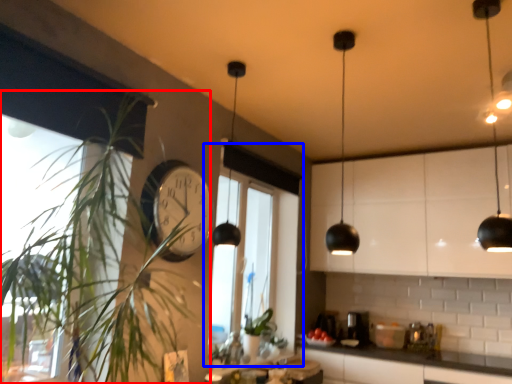
Question: Which object appears farthest to the camera in this image, houseplant (highlighted by a red box) or window (highlighted by a blue box)?

Choices:
 (A) houseplant
 (B) window

Answer: (B)